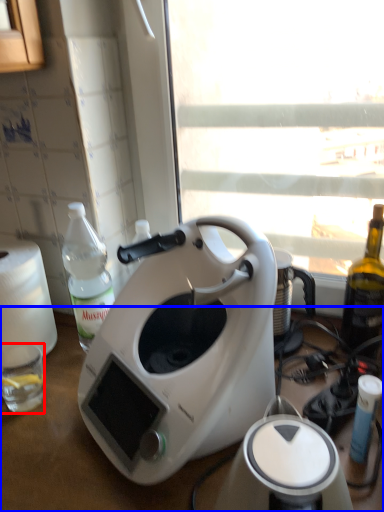
Question: Which of the following is the closest to the observer, coffee cup (highlighted by a red box) or table (highlighted by a blue box)?

Choices:
 (A) coffee cup
 (B) table

Answer: (B)